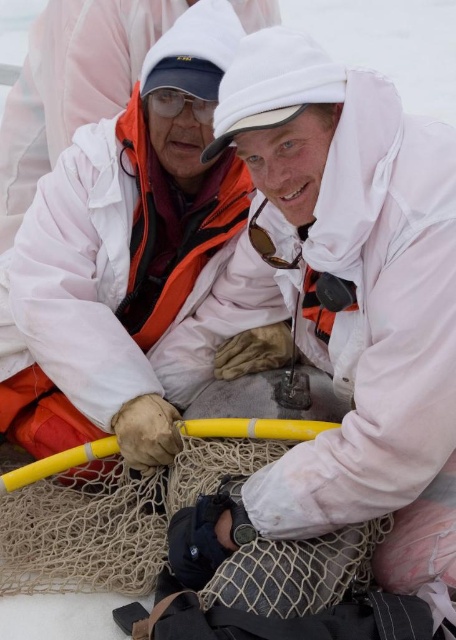
You are a researcher preparing to take a sample from the ice. You need to ensure your equipment is accessible. Which object, the white matte jacket at center or the matte black goggles at upper center, is closer to you?

The white matte jacket at center is closer to you because it is in front of the matte black goggles at upper center.

You are a researcher preparing to carry out an experiment in the cold environment shown. You need to wear both the white matte jacket at center and the matte black goggles at upper center. Based on their sizes, which item should you put on first?

The white matte jacket at center is wider than the matte black goggles at upper center. Therefore, you should put on the matte black goggles at upper center first to avoid having to adjust them after putting on the wider jacket.

You are a researcher in the field and need to locate the white matte jacket at center. Based on the coordinates provided, where would you find it in the image?

The white matte jacket at center is located at the coordinates point (x=348, y=301) in the image.